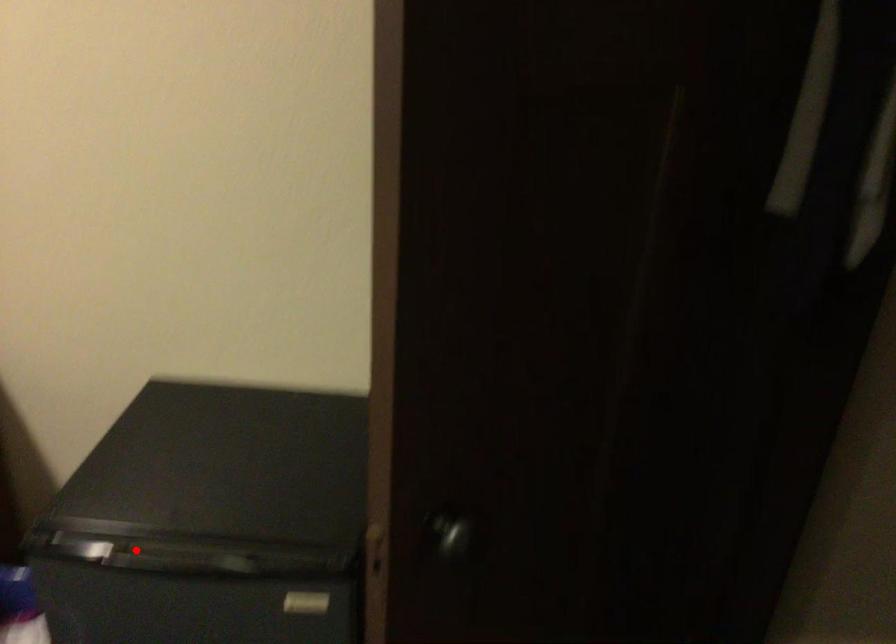
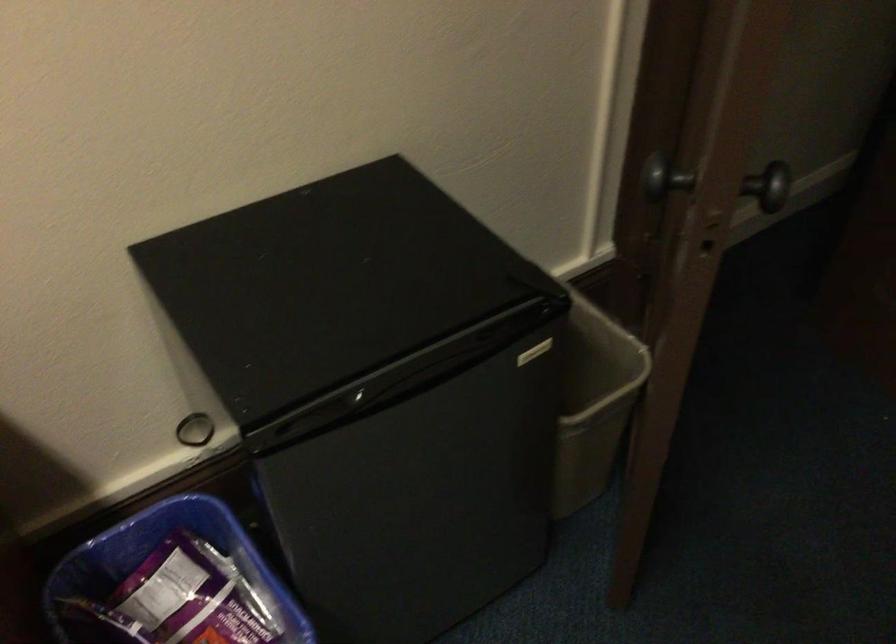
Locate, in the second image, the point that corresponds to the highlighted location in the first image.

(365, 399)